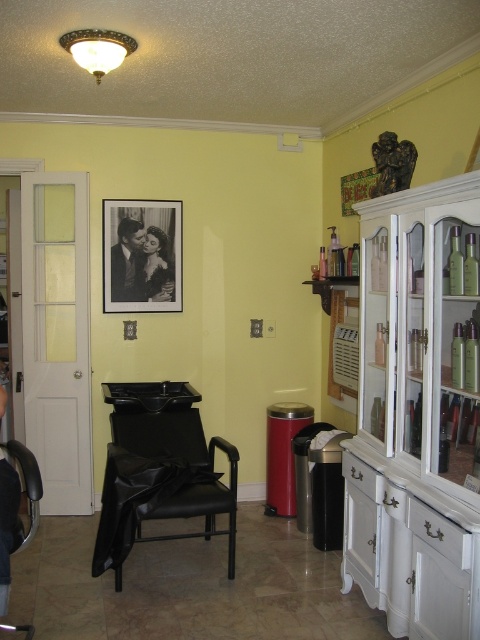
You are a customer entering the salon and see the black paper at upper center and the black leather armchair at lower left. Which object is located to the right of the other?

The black paper at upper center is positioned on the right side of black leather armchair at lower left.

You are a customer entering the salon and need to choose between the black leather armchair at center and the black leather armchair at lower left. Which chair offers more seating space?

The black leather armchair at center has a larger width than the black leather armchair at lower left, so it offers more seating space.

You are a customer entering the salon and need to reach the white glossy cabinet at right to grab a brochure. The salon has a 6 feet wide entrance. Can you safely walk through the entrance to reach the cabinet?

The white glossy cabinet at right is 6.52 feet away from the camera. Since the entrance is 6 feet wide, the customer can safely walk through the entrance to reach the cabinet as the distance to the cabinet is greater than the entrance width.